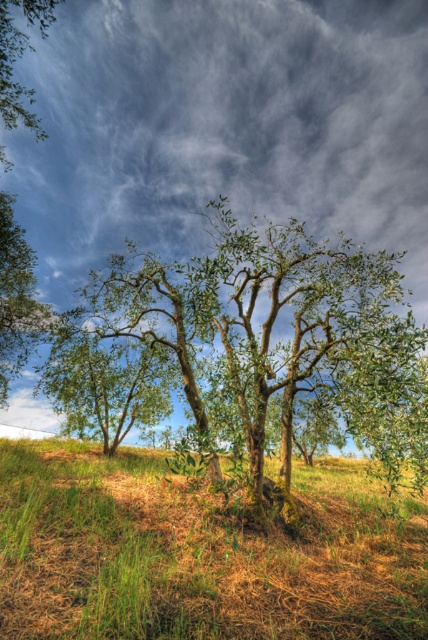
You are a gardener planning to mow the green grass at lower left and trim the green leafy tree at center. Based on their size, which task would require more time and effort?

The green leafy tree at center requires more time and effort because it occupies more space than the green grass at lower left.

You are standing in the middle of the field and want to find the tallest tree between the green leafy tree at center and the green leafy tree at left. Which one should you look towards?

The green leafy tree at left is taller than the green leafy tree at center, so you should look towards the green leafy tree at left.